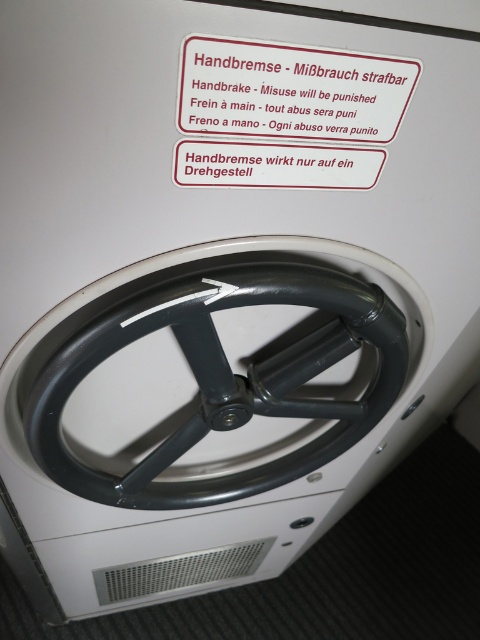
Question: Which of the following is the farthest from the observer?

Choices:
 (A) (207, 314)
 (B) (312, 161)
 (C) (283, 61)

Answer: (A)

Question: Which point is farther to the camera?

Choices:
 (A) black matte steering wheel at center
 (B) white plastic sign at upper center
 (C) white paper sticker at upper center

Answer: (A)

Question: Is black matte steering wheel at center above white plastic sign at upper center?

Choices:
 (A) no
 (B) yes

Answer: (A)

Question: Which point appears farthest from the camera in this image?

Choices:
 (A) (362, 156)
 (B) (210, 273)

Answer: (B)

Question: From the image, what is the correct spatial relationship of black matte steering wheel at center in relation to white plastic sign at upper center?

Choices:
 (A) above
 (B) below

Answer: (B)

Question: Can you confirm if black matte steering wheel at center is thinner than white plastic sign at upper center?

Choices:
 (A) no
 (B) yes

Answer: (A)